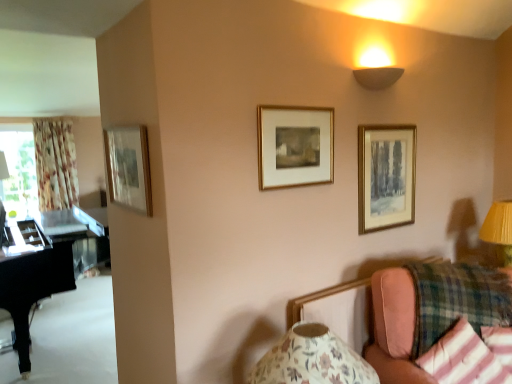
Question: Could you tell me if floral fabric curtain at left is facing pink fabric couch at lower right?

Choices:
 (A) yes
 (B) no

Answer: (A)

Question: From a real-world perspective, does floral fabric curtain at left stand above pink fabric couch at lower right?

Choices:
 (A) no
 (B) yes

Answer: (B)

Question: Does floral fabric curtain at left have a larger size compared to pink fabric couch at lower right?

Choices:
 (A) no
 (B) yes

Answer: (A)

Question: Is floral fabric curtain at left positioned in front of pink fabric couch at lower right?

Choices:
 (A) yes
 (B) no

Answer: (B)

Question: Can you confirm if floral fabric curtain at left is taller than pink fabric couch at lower right?

Choices:
 (A) no
 (B) yes

Answer: (B)

Question: Is floral fabric curtain at left taller or shorter than floral paper lampshade at lower right, which ranks as the 2th table lamp in top-to-bottom order?

Choices:
 (A) short
 (B) tall

Answer: (B)

Question: Does point (x=72, y=140) appear closer or farther from the camera than point (x=309, y=329)?

Choices:
 (A) closer
 (B) farther

Answer: (B)

Question: Relative to floral paper lampshade at lower right, the 2th table lamp from the back, is floral fabric curtain at left in front or behind?

Choices:
 (A) behind
 (B) front

Answer: (A)

Question: In terms of size, does floral fabric curtain at left appear bigger or smaller than floral paper lampshade at lower right, the first table lamp when ordered from bottom to top?

Choices:
 (A) big
 (B) small

Answer: (A)

Question: From a real-world perspective, is gold-framed painting at upper right, the 3th picture frame from the left, positioned above or below matte beige wall sconce at upper right?

Choices:
 (A) below
 (B) above

Answer: (A)

Question: From the image's perspective, relative to matte beige wall sconce at upper right, is gold-framed painting at upper right, positioned as the first picture frame in right-to-left order, above or below?

Choices:
 (A) below
 (B) above

Answer: (A)

Question: Considering the positions of gold-framed painting at upper right, the 3th picture frame from the left, and matte beige wall sconce at upper right in the image, is gold-framed painting at upper right, the 3th picture frame from the left, bigger or smaller than matte beige wall sconce at upper right?

Choices:
 (A) small
 (B) big

Answer: (B)

Question: In the image, is gold-framed painting at upper right, positioned as the first picture frame in right-to-left order, positioned in front of or behind matte beige wall sconce at upper right?

Choices:
 (A) front
 (B) behind

Answer: (B)

Question: In the image, is striped cotton pillow at lower right, positioned as the first pillow in left-to-right order, positioned in front of or behind gold wooden picture frame at center, the second picture frame in the left-to-right sequence?

Choices:
 (A) front
 (B) behind

Answer: (A)

Question: Is striped cotton pillow at lower right, positioned as the first pillow in left-to-right order, wider or thinner than gold wooden picture frame at center, the second picture frame in the left-to-right sequence?

Choices:
 (A) wide
 (B) thin

Answer: (A)